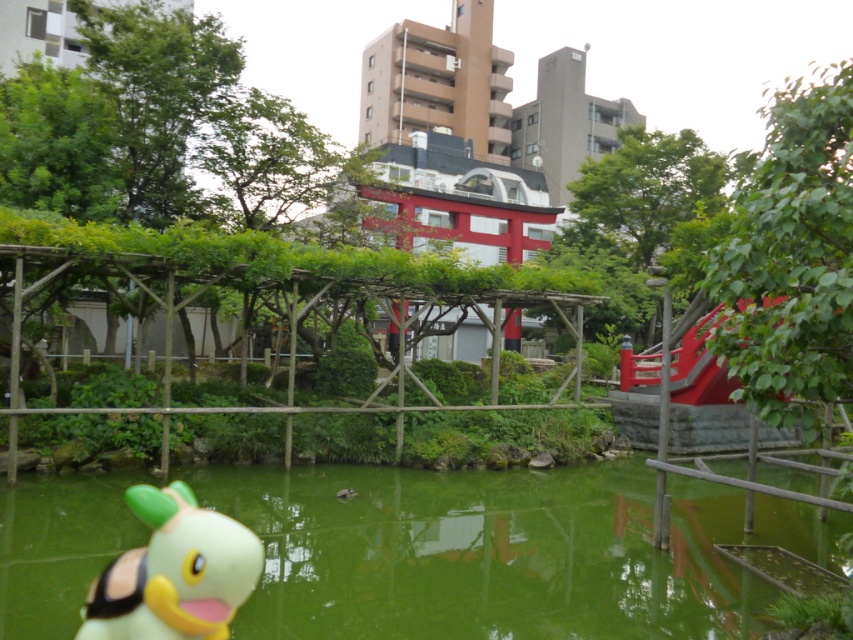
Does point (141, 576) come behind point (212, 412)?

No, (141, 576) is in front of (212, 412).

The height and width of the screenshot is (640, 853). What do you see at coordinates (173, 572) in the screenshot?
I see `yellow matte plush toy at lower left` at bounding box center [173, 572].

Who is more forward, (204, 552) or (62, 248)?

Point (204, 552) is more forward.

Image resolution: width=853 pixels, height=640 pixels. I want to click on yellow matte plush toy at lower left, so click(173, 572).

Is green liquid water at center further to camera compared to wooden trellis at center?

No.

Who is shorter, green liquid water at center or wooden trellis at center?

green liquid water at center

Which is behind, point (361, 604) or point (15, 374)?

Positioned behind is point (15, 374).

At what (x,y) coordinates should I click in order to perform the action: click on green liquid water at center. Please return your answer as a coordinate pair (x, y). The image size is (853, 640). Looking at the image, I should click on (502, 552).

Is point (398, 602) closer to viewer compared to point (186, 589)?

No.

Who is higher up, green liquid water at center or yellow matte plush toy at lower left?

yellow matte plush toy at lower left

Identify the location of green liquid water at center. (502, 552).